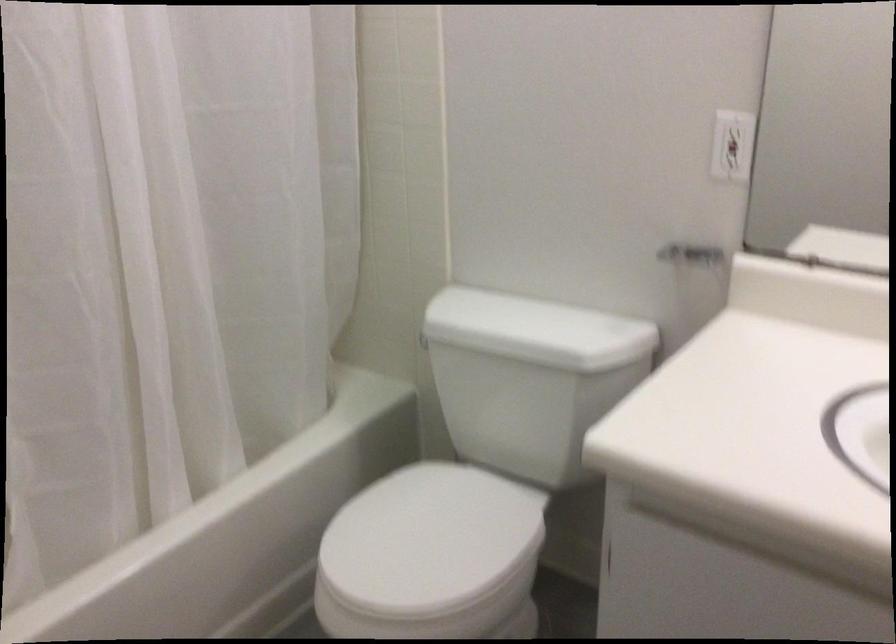
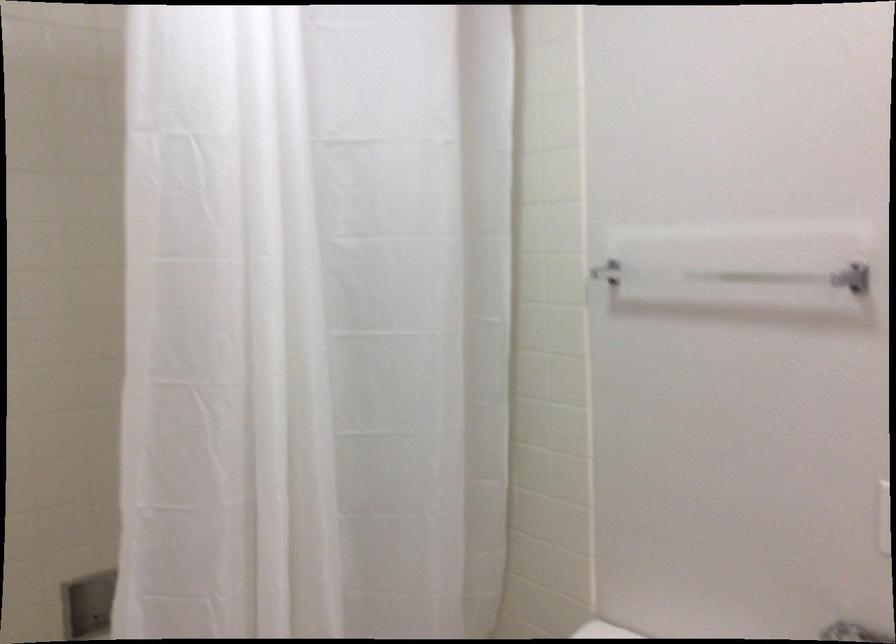
First-person continuous shooting, in which direction is the camera rotating?

The camera rotated toward left-up.